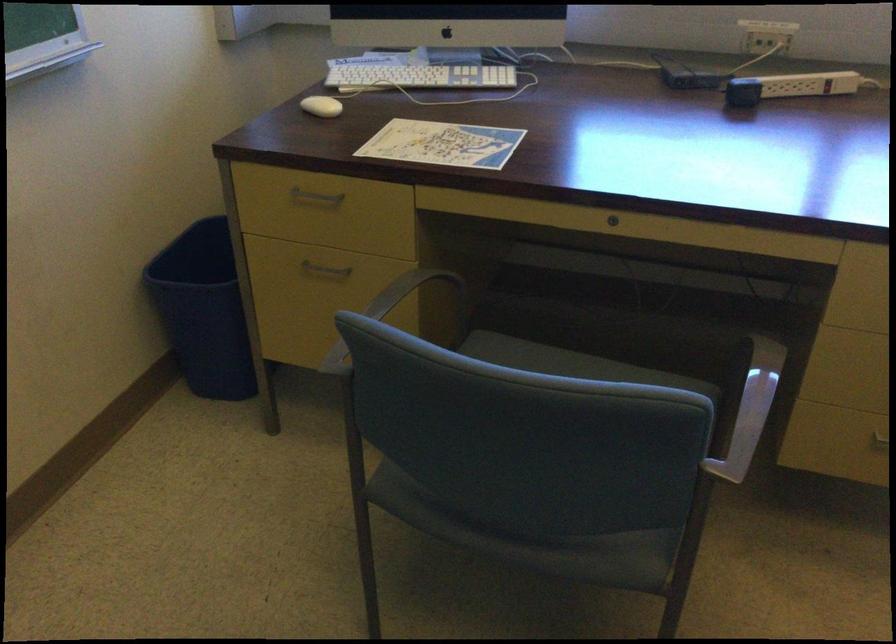
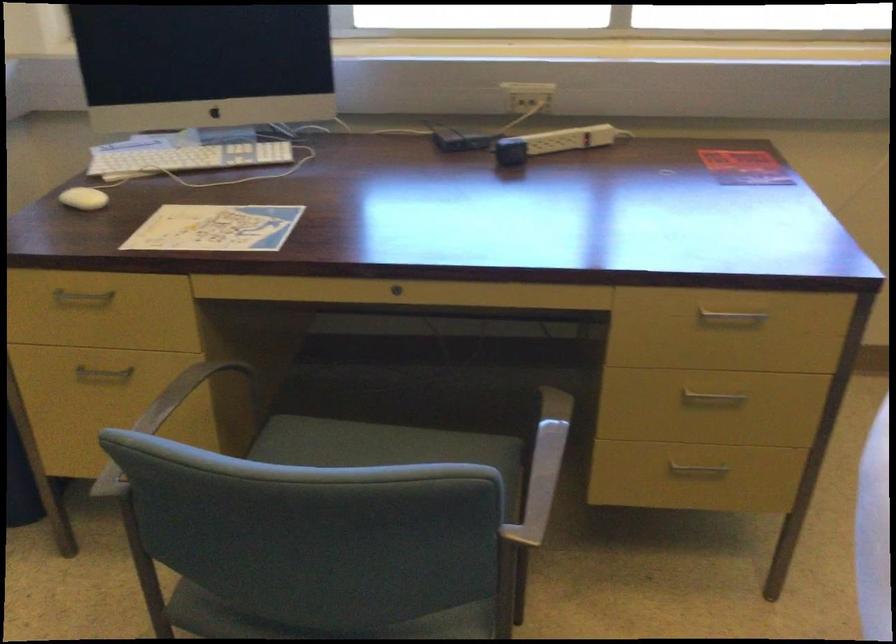
Question: How did the camera likely rotate?

Choices:
 (A) Left
 (B) Right
 (C) Up
 (D) Down

Answer: (B)